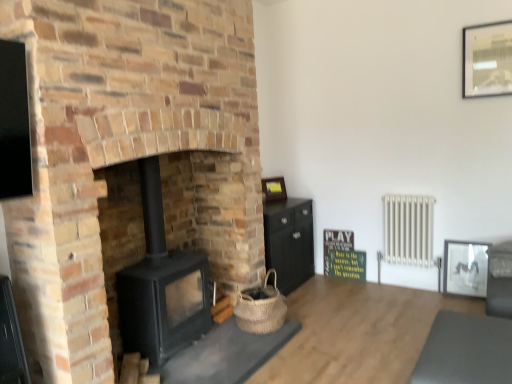
This screenshot has height=384, width=512. In order to click on vacant space situated on the left part of woven natural basket at lower center in this screenshot , I will do `click(216, 333)`.